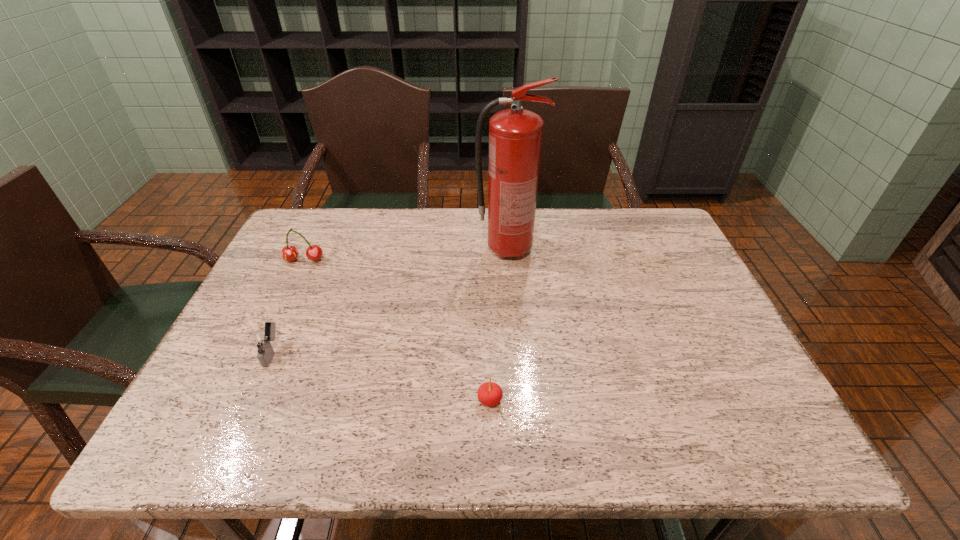
Choose which object is the third nearest neighbor to the tallest object. Please provide its 2D coordinates. Your answer should be formatted as a tuple, i.e. [(x, y)], where the tuple contains the x and y coordinates of a point satisfying the conditions above.

[(260, 340)]

At what (x,y) coordinates should I click in order to perform the action: click on free location that satisfies the following two spatial constraints: 1. with stems pointing upwards on the igniter; 2. on the right side of the left cherry. Please return your answer as a coordinate pair (x, y). Image resolution: width=960 pixels, height=540 pixels. Looking at the image, I should click on (260, 352).

Image resolution: width=960 pixels, height=540 pixels. In order to click on free space that satisfies the following two spatial constraints: 1. with stems pointing upwards on the farther cherry; 2. on the right side of the igniter in this screenshot , I will do `click(260, 352)`.

Find the location of a particular element. free space that satisfies the following two spatial constraints: 1. on the handle side the fire extinguisher; 2. with stems pointing upwards on the left cherry is located at coordinates (509, 260).

Find the location of `vacant space that satisfies the following two spatial constraints: 1. on the handle side the tallest object; 2. with stems pointing upwards on the third shortest object`. vacant space that satisfies the following two spatial constraints: 1. on the handle side the tallest object; 2. with stems pointing upwards on the third shortest object is located at coordinates (509, 260).

This screenshot has width=960, height=540. Find the location of `free location that satisfies the following two spatial constraints: 1. on the handle side the fire extinguisher; 2. with stems pointing upwards on the left cherry`. free location that satisfies the following two spatial constraints: 1. on the handle side the fire extinguisher; 2. with stems pointing upwards on the left cherry is located at coordinates (509, 260).

Locate an element on the screen. This screenshot has width=960, height=540. vacant region that satisfies the following two spatial constraints: 1. on the handle side the fire extinguisher; 2. with stems pointing upwards on the farther cherry is located at coordinates (509, 260).

In order to click on vacant space that satisfies the following two spatial constraints: 1. on the front side of the shorter cherry; 2. on the right side of the third farthest object in this screenshot , I will do `click(251, 400)`.